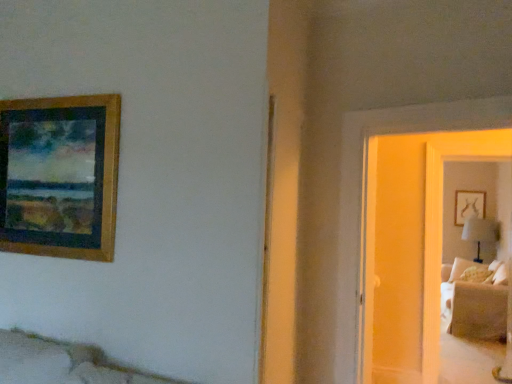
Question: In terms of height, does white fabric table lamp at right look taller or shorter compared to suede beige couch at right?

Choices:
 (A) short
 (B) tall

Answer: (A)

Question: Does point pyautogui.click(x=472, y=233) appear closer or farther from the camera than point pyautogui.click(x=496, y=314)?

Choices:
 (A) farther
 (B) closer

Answer: (A)

Question: Based on their relative distances, which object is nearer to the matte glass door at right?

Choices:
 (A) white fabric table lamp at right
 (B) suede beige couch at right
 (C) wooden picture frame at upper left

Answer: (B)

Question: Which is nearer to the wooden picture frame at upper left?

Choices:
 (A) matte glass door at right
 (B) suede beige couch at right
 (C) white fabric table lamp at right

Answer: (A)